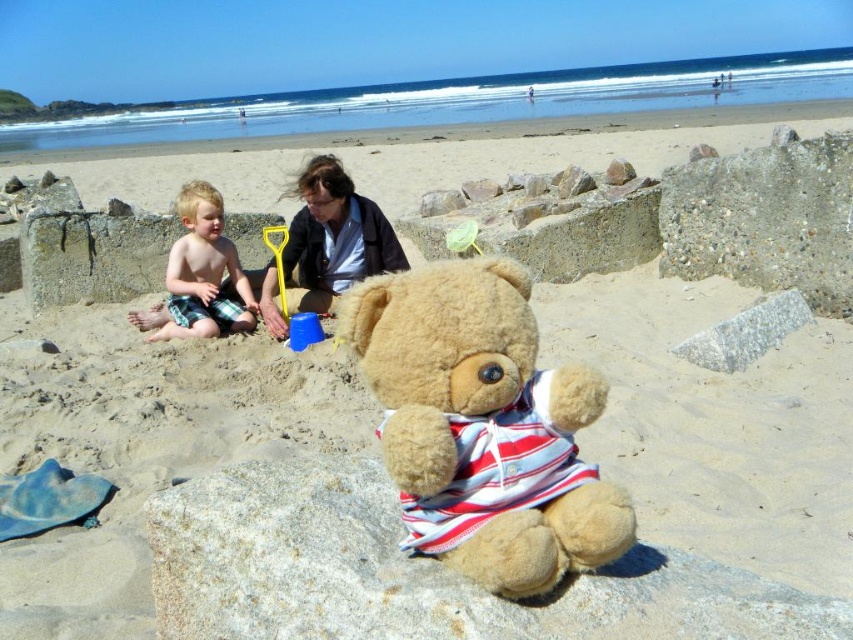
Is smooth brown hair at center thinner than blonde hair boy at left?

No, smooth brown hair at center is not thinner than blonde hair boy at left.

Does point (363, 244) come behind point (216, 264)?

No.

Which is in front, point (393, 243) or point (149, 321)?

Point (393, 243)

You are a GUI agent. You are given a task and a screenshot of the screen. Output one action in this format:
    pyautogui.click(x=<x>, y=<y>)
    Task: Click on the smooth brown hair at center
    This screenshot has height=640, width=853.
    Given the screenshot: What is the action you would take?
    pyautogui.click(x=328, y=243)

Who is more distant from viewer, [672,552] or [178,205]?

The point [178,205] is behind.

Can you confirm if gray rough stone at center is thinner than blonde hair boy at left?

Incorrect, gray rough stone at center's width is not less than blonde hair boy at left's.

Does point (590, 582) lie in front of point (206, 278)?

Yes, it is in front of point (206, 278).

Find the location of `gray rough stone at center`. gray rough stone at center is located at coordinates (418, 573).

Which of these two, fuzzy brown teddy bear at center or smooth brown hair at center, stands shorter?

fuzzy brown teddy bear at center

What do you see at coordinates (483, 424) in the screenshot?
I see `fuzzy brown teddy bear at center` at bounding box center [483, 424].

Which is in front, point (431, 282) or point (302, 253)?

Point (431, 282) is in front.

Locate an element on the screen. The width and height of the screenshot is (853, 640). fuzzy brown teddy bear at center is located at coordinates (483, 424).